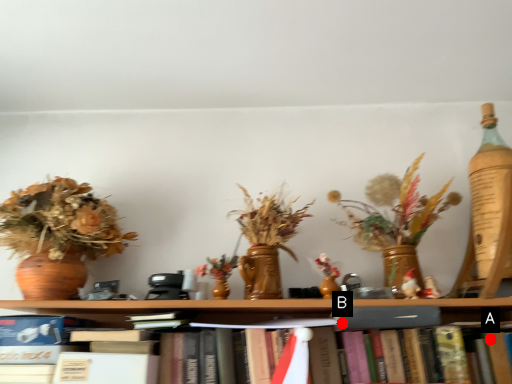
Question: Two points are circled on the image, labeled by A and B beside each circle. Which point appears closest to the camera in this image?

Choices:
 (A) A is closer
 (B) B is closer

Answer: (B)